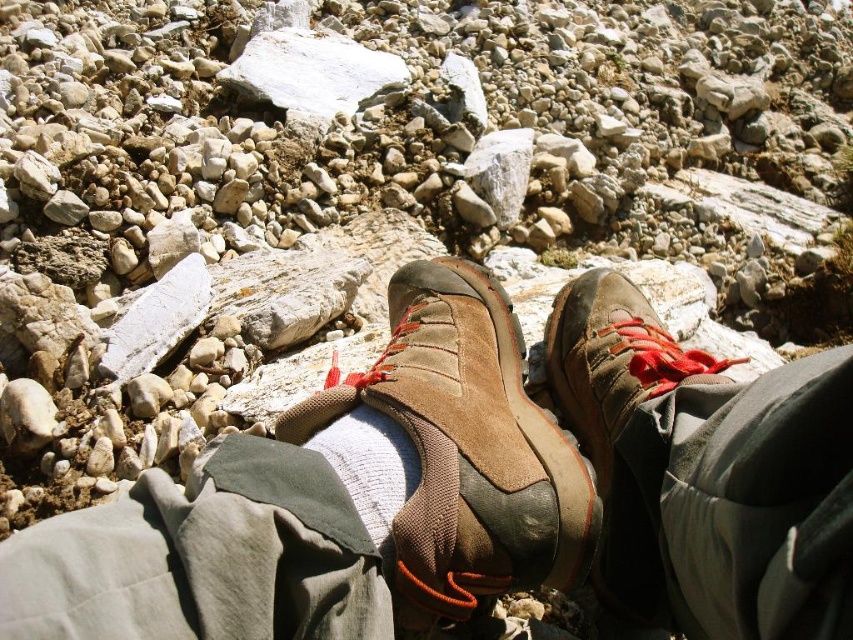
Looking at this image, you are a hiker trying to cross a rocky path. You notice your brown suede shoes at center and white cotton sock at center. Which object is positioned to the right when looking at them?

The brown suede shoes at center is to the right of white cotton sock at center, so the brown suede shoes at center is positioned to the right.

You are standing in a rocky area and see two pairs of brown suede shoes. One is labeled as brown suede shoes at center and the other as brown suede shoe at center. Which one is positioned to the left?

The brown suede shoes at center are positioned to the left of the brown suede shoe at center.